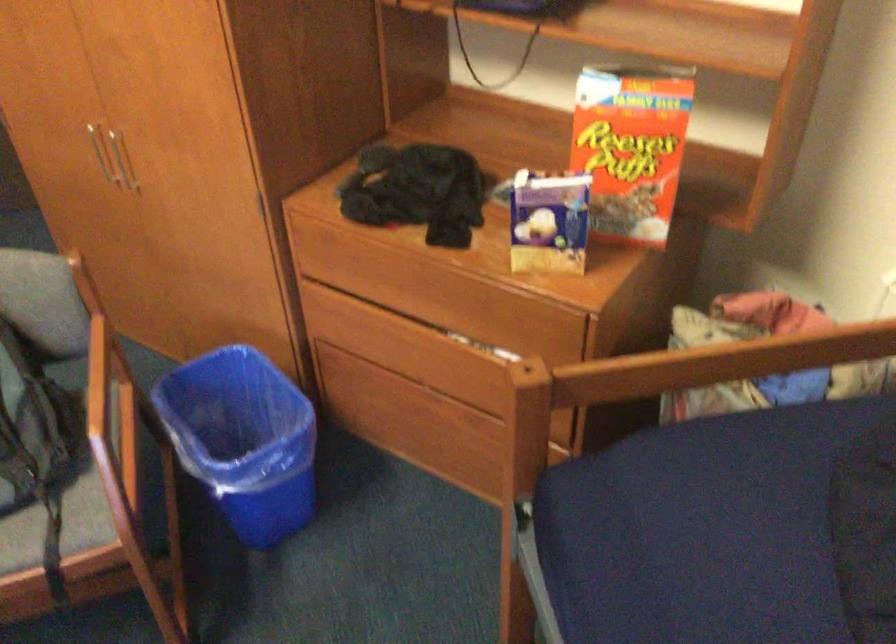
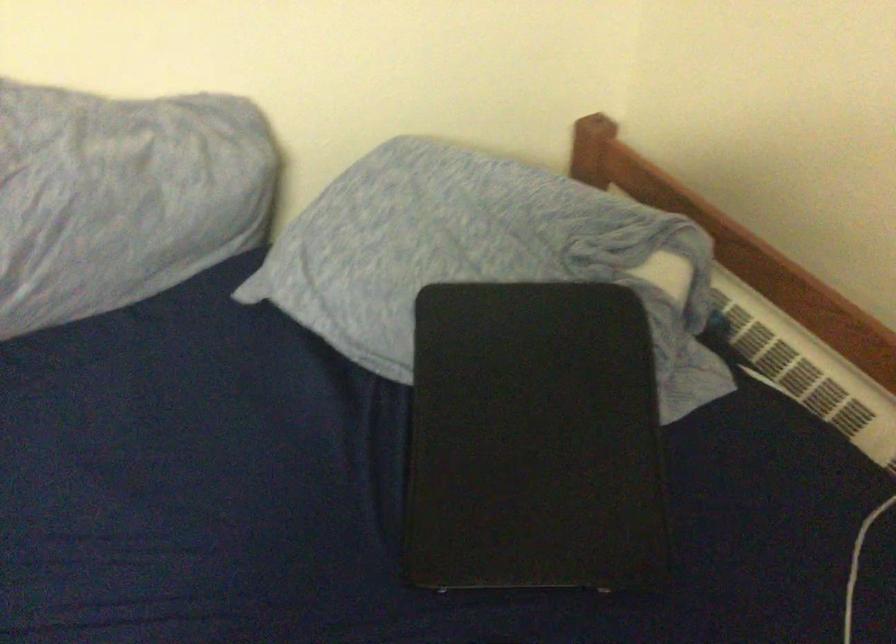
How did the camera likely rotate?

The camera's rotation is toward right-down.